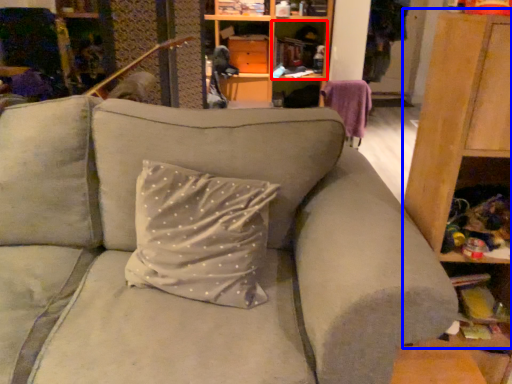
Question: Which point is closer to the camera, cabinet (highlighted by a red box) or dresser (highlighted by a blue box)?

Choices:
 (A) cabinet
 (B) dresser

Answer: (B)